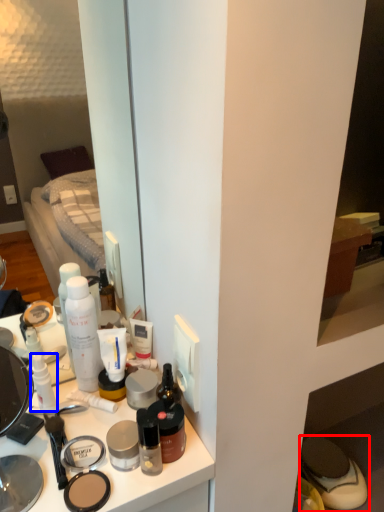
Question: Which of the following is the farthest to the observer, footwear (highlighted by a red box) or toiletry (highlighted by a blue box)?

Choices:
 (A) footwear
 (B) toiletry

Answer: (A)